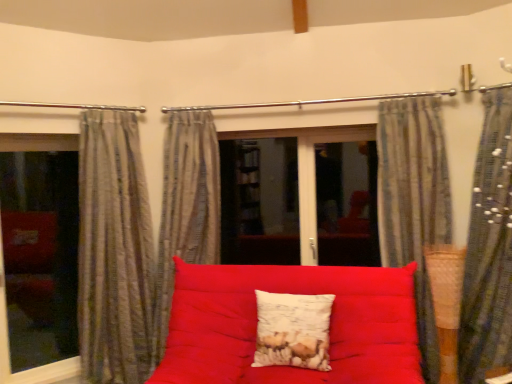
Question: From the image's perspective, does metallic rod at upper center appear higher than transparent glass window at left?

Choices:
 (A) yes
 (B) no

Answer: (A)

Question: Does metallic rod at upper center have a larger size compared to transparent glass window at left?

Choices:
 (A) yes
 (B) no

Answer: (B)

Question: Can you confirm if metallic rod at upper center is positioned to the left of transparent glass window at left?

Choices:
 (A) no
 (B) yes

Answer: (A)

Question: Is metallic rod at upper center behind transparent glass window at left?

Choices:
 (A) yes
 (B) no

Answer: (A)

Question: Is transparent glass window at left at the back of metallic rod at upper center?

Choices:
 (A) yes
 (B) no

Answer: (B)

Question: Is metallic rod at upper center far from transparent glass window at left?

Choices:
 (A) yes
 (B) no

Answer: (A)

Question: Considering the relative sizes of transparent glass window at left and metallic rod at upper center in the image provided, is transparent glass window at left smaller than metallic rod at upper center?

Choices:
 (A) yes
 (B) no

Answer: (B)

Question: From a real-world perspective, is transparent glass window at left located higher than metallic rod at upper center?

Choices:
 (A) yes
 (B) no

Answer: (B)

Question: From the image's perspective, is transparent glass window at left on metallic rod at upper center?

Choices:
 (A) no
 (B) yes

Answer: (A)

Question: Is transparent glass window at left shorter than metallic rod at upper center?

Choices:
 (A) no
 (B) yes

Answer: (A)

Question: Is transparent glass window at left aimed at metallic rod at upper center?

Choices:
 (A) yes
 (B) no

Answer: (B)

Question: Is transparent glass window at left closer to camera compared to metallic rod at upper center?

Choices:
 (A) yes
 (B) no

Answer: (A)

Question: From the image's perspective, is striped fabric curtain at right, which appears as the 1th curtain when viewed from the right, located above white textured pillow at center?

Choices:
 (A) no
 (B) yes

Answer: (B)